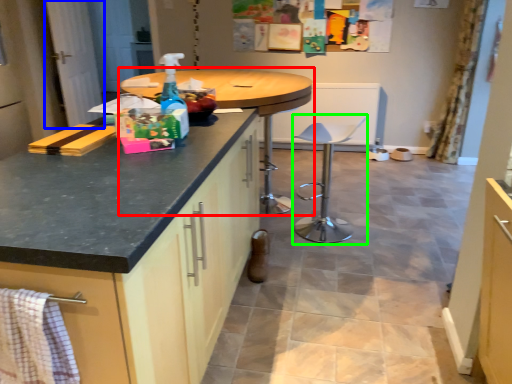
Question: Which object is the farthest from table (highlighted by a red box)? Choose among these: screen door (highlighted by a blue box) or swivel chair (highlighted by a green box).

Choices:
 (A) screen door
 (B) swivel chair

Answer: (A)